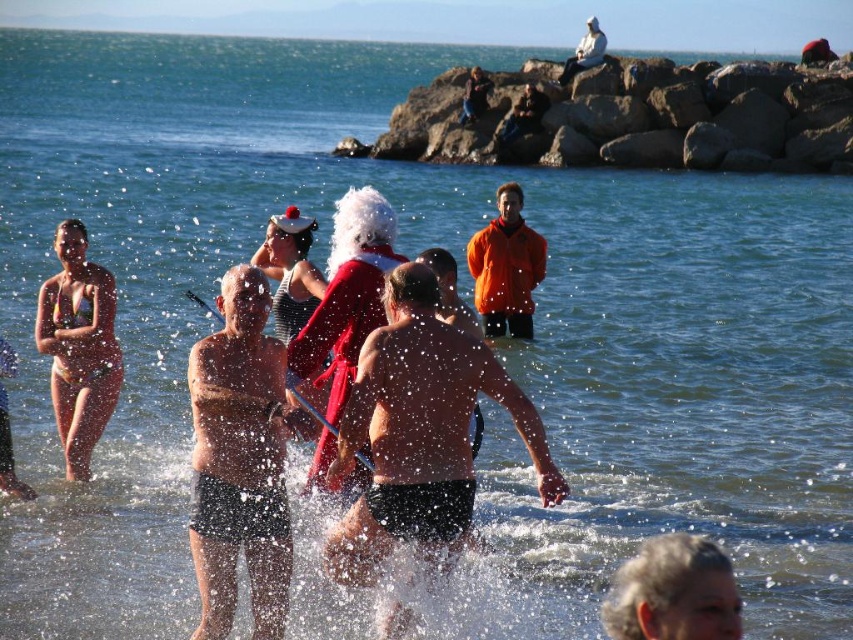
Between white fabric santa at upper center and santa hat at center, which one appears on the right side from the viewer's perspective?

white fabric santa at upper center

In the scene shown: Measure the distance between white fabric santa at upper center and camera.

The distance of white fabric santa at upper center from camera is 71.02 meters.

Where is `white fabric santa at upper center`? white fabric santa at upper center is located at coordinates pos(584,52).

Can you confirm if orange matte jacket at center is thinner than white fabric santa at upper center?

Correct, orange matte jacket at center's width is less than white fabric santa at upper center's.

Between point (531, 248) and point (585, 28), which one is positioned behind?

Point (585, 28)

Who is more distant from viewer, (474, 236) or (561, 81)?

The point (561, 81) is behind.

At what (x,y) coordinates should I click in order to perform the action: click on orange matte jacket at center. Please return your answer as a coordinate pair (x, y). Image resolution: width=853 pixels, height=640 pixels. Looking at the image, I should click on (506, 268).

Does gray hair at lower right have a lesser width compared to white fabric santa at upper center?

Yes.

Does gray hair at lower right have a lesser height compared to white fabric santa at upper center?

Yes.

Where is `gray hair at lower right`? Image resolution: width=853 pixels, height=640 pixels. gray hair at lower right is located at coordinates (674, 593).